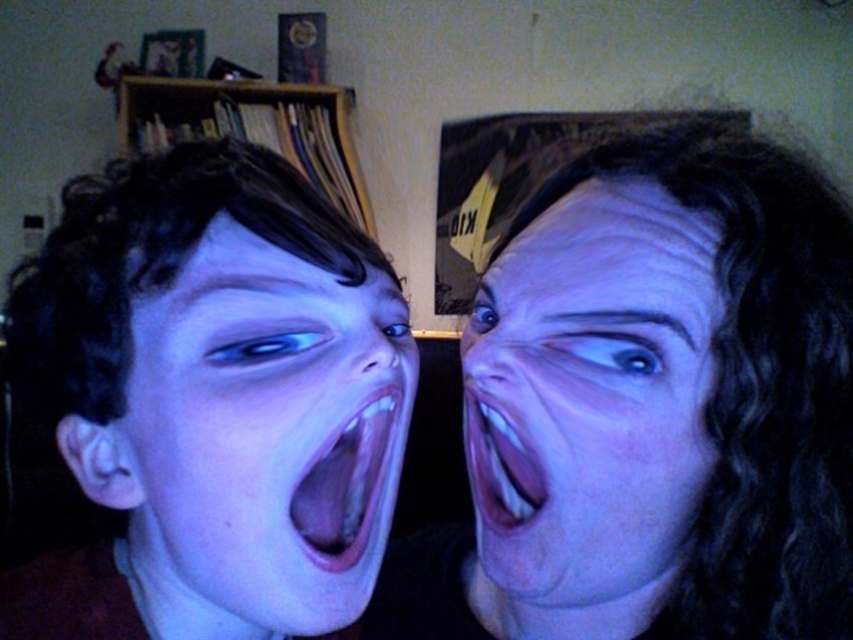
From the picture: You are standing in front of the two people in the image. Based on their positions relative to each other, which point, point 1 at coordinates (x=653, y=532) or point 2 at coordinates (x=479, y=417), is closer to you?

Point 1 at coordinates (x=653, y=532) is closer to you because it is in front of point 2 at coordinates (x=479, y=417).